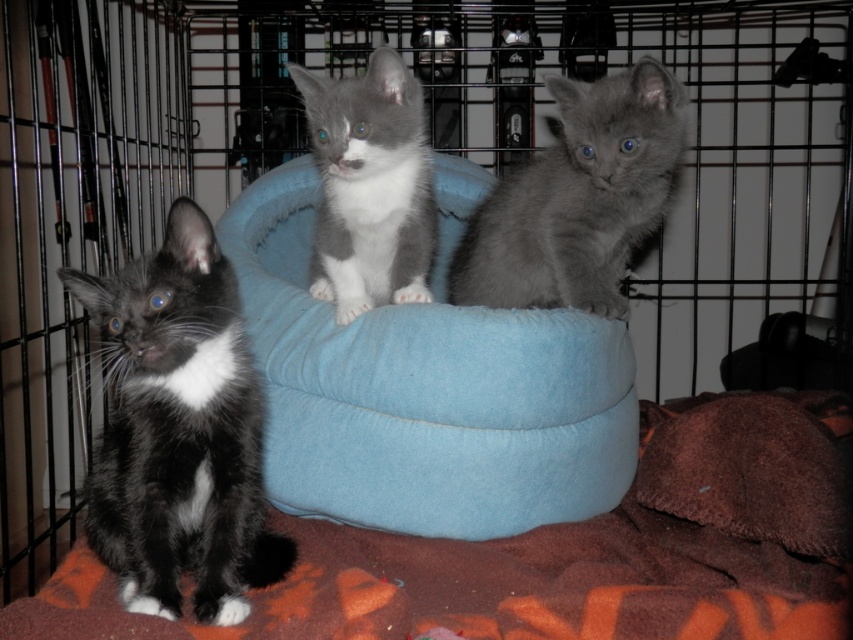
Who is more distant from viewer, (250, 506) or (412, 180)?

Positioned behind is point (412, 180).

Can you confirm if black soft fur cat at left is bigger than gray soft fur kitten at center?

Yes.

Find the location of a particular element. This screenshot has height=640, width=853. black soft fur cat at left is located at coordinates (178, 429).

Where is `black soft fur cat at left`? The image size is (853, 640). black soft fur cat at left is located at coordinates (178, 429).

Which is in front, point (664, 92) or point (352, 232)?

Point (664, 92)

Does gray fluffy kitten at center have a lesser width compared to gray soft fur kitten at center?

No, gray fluffy kitten at center is not thinner than gray soft fur kitten at center.

Where is `gray fluffy kitten at center`? This screenshot has width=853, height=640. gray fluffy kitten at center is located at coordinates (578, 196).

I want to click on gray fluffy kitten at center, so click(x=578, y=196).

How much distance is there between blue fabric cat bed at center and gray soft fur kitten at center?

A distance of 6.95 inches exists between blue fabric cat bed at center and gray soft fur kitten at center.

Who is more distant from viewer, [573,320] or [314,120]?

Positioned behind is point [314,120].

The width and height of the screenshot is (853, 640). I want to click on blue fabric cat bed at center, so click(424, 394).